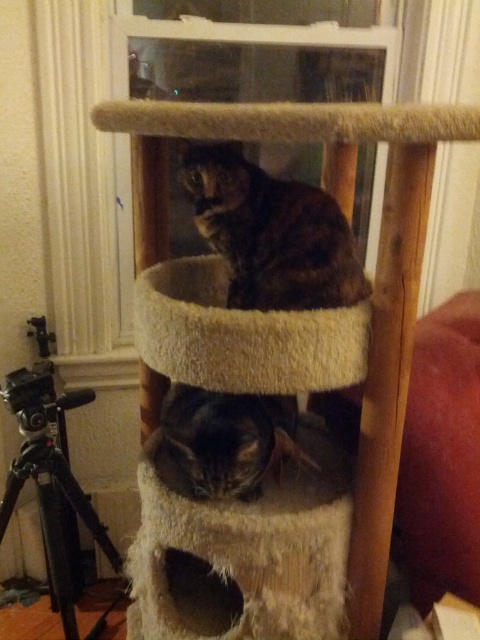
Who is lower down, beige fuzzy cat tree at center or fuzzy beige cat bed at center?

beige fuzzy cat tree at center

In the scene shown: Is beige fuzzy cat tree at center to the right of fuzzy beige cat bed at center from the viewer's perspective?

Indeed, beige fuzzy cat tree at center is positioned on the right side of fuzzy beige cat bed at center.

The height and width of the screenshot is (640, 480). Describe the element at coordinates (373, 282) in the screenshot. I see `beige fuzzy cat tree at center` at that location.

The width and height of the screenshot is (480, 640). I want to click on beige fuzzy cat tree at center, so click(x=373, y=282).

Where is `fuzzy beige cat bed at center`? This screenshot has height=640, width=480. fuzzy beige cat bed at center is located at coordinates (241, 333).

Is fuzzy beige cat bed at center positioned in front of dark brown fur cat at center?

Yes, it is in front of dark brown fur cat at center.

Where is `fuzzy beige cat bed at center`? fuzzy beige cat bed at center is located at coordinates (241, 333).

Describe the element at coordinates (272, 234) in the screenshot. I see `dark brown fur cat at center` at that location.

This screenshot has width=480, height=640. Describe the element at coordinates (272, 234) in the screenshot. I see `dark brown fur cat at center` at that location.

Where is `dark brown fur cat at center`? The height and width of the screenshot is (640, 480). dark brown fur cat at center is located at coordinates (272, 234).